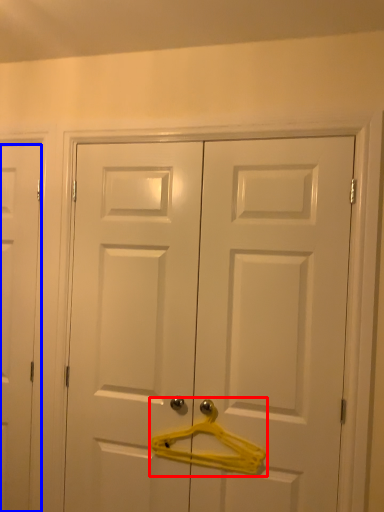
Question: Which object appears closest to the camera in this image, hanger (highlighted by a red box) or door (highlighted by a blue box)?

Choices:
 (A) hanger
 (B) door

Answer: (A)